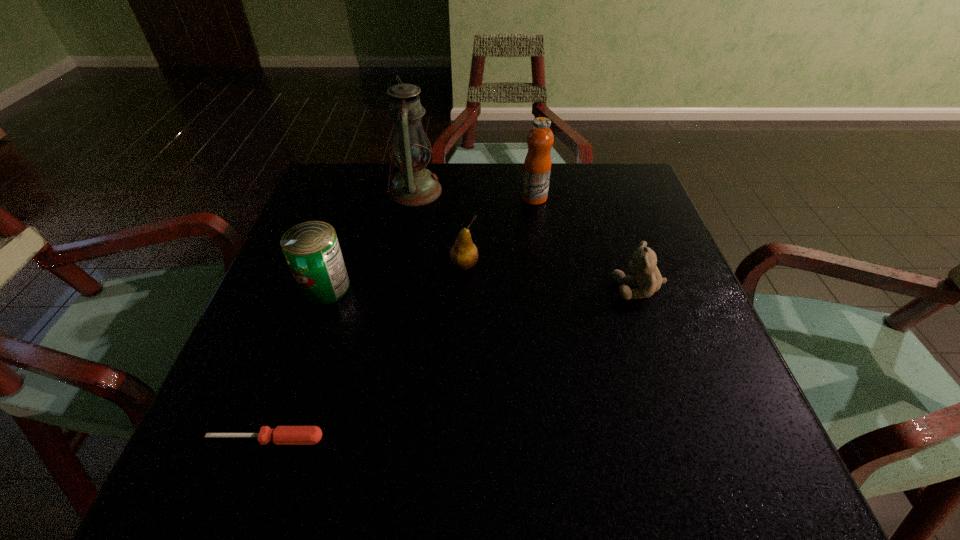
Find the location of a particular element. Image resolution: width=960 pixels, height=540 pixels. object present at the near edge is located at coordinates (282, 435).

Find the location of a particular element. This screenshot has height=540, width=960. can at the left edge is located at coordinates (312, 251).

Where is `screwdriver that is at the left edge`? Image resolution: width=960 pixels, height=540 pixels. screwdriver that is at the left edge is located at coordinates (282, 435).

The width and height of the screenshot is (960, 540). Find the location of `object positioned at the right edge`. object positioned at the right edge is located at coordinates (643, 262).

Identify the location of object at the near left corner. 282,435.

I want to click on vacant space at the far edge of the desktop, so click(x=502, y=190).

In the image, there is a desktop. Where is `vacant space at the near edge`? The width and height of the screenshot is (960, 540). vacant space at the near edge is located at coordinates (663, 491).

Image resolution: width=960 pixels, height=540 pixels. What are the coordinates of `free space at the left edge of the desktop` in the screenshot? It's located at (x=261, y=319).

Where is `free space at the right edge`? This screenshot has height=540, width=960. free space at the right edge is located at coordinates click(x=654, y=296).

The image size is (960, 540). Identify the location of vacant region at the far left corner. (325, 177).